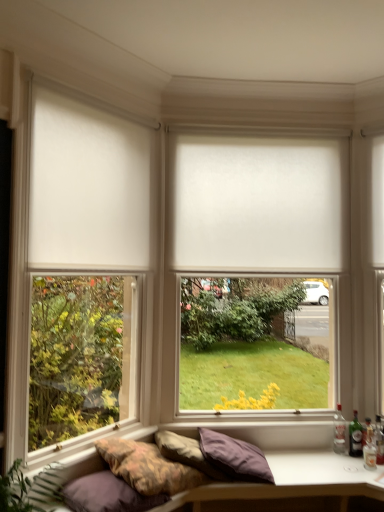
Locate an element on the screen. The height and width of the screenshot is (512, 384). purple fabric pillow at lower center, the second pillow in the right-to-left sequence is located at coordinates (186, 453).

The width and height of the screenshot is (384, 512). What do you see at coordinates (186, 453) in the screenshot?
I see `purple fabric pillow at lower center, the second pillow in the right-to-left sequence` at bounding box center [186, 453].

Image resolution: width=384 pixels, height=512 pixels. Describe the element at coordinates (291, 482) in the screenshot. I see `textured fabric studio couch at lower center` at that location.

Describe the element at coordinates (355, 436) in the screenshot. I see `green glass bottle at lower right, which appears as the 3th bottle when viewed from the right` at that location.

What is the approximate height of white matte window at center?

white matte window at center is 7.32 feet in height.

What do you see at coordinates (88, 187) in the screenshot? I see `white matte curtain at left` at bounding box center [88, 187].

Where is `white matte window frame at upper left`? white matte window frame at upper left is located at coordinates (77, 272).

At what (x,y) coordinates should I click in order to perform the action: click on white matte window blind at center. Please return your answer as a coordinate pair (x, y). Image resolution: width=384 pixels, height=512 pixels. Looking at the image, I should click on (258, 204).

Can we say translucent glass bottle at right, which appears as the second bottle when viewed from the right, lies outside textured fabric studio couch at lower center?

Absolutely, translucent glass bottle at right, which appears as the second bottle when viewed from the right, is external to textured fabric studio couch at lower center.

Consider the image. Does translucent glass bottle at right, which appears as the second bottle when viewed from the right, have a lesser height compared to textured fabric studio couch at lower center?

Yes.

Who is smaller, translucent glass bottle at right, which appears as the second bottle when viewed from the right, or textured fabric studio couch at lower center?

translucent glass bottle at right, which appears as the second bottle when viewed from the right, is smaller.

Is textured fabric studio couch at lower center at the back of translucent glass bottle at right, which appears as the third bottle when viewed from the left?

translucent glass bottle at right, which appears as the third bottle when viewed from the left, does not have its back to textured fabric studio couch at lower center.

Is point (367, 426) closer to camera compared to point (381, 430)?

No, it is not.

Which object is more forward, translucent glass bottle at right, which appears as the second bottle when viewed from the right, or translucent glass bottle at right, the 4th bottle from the left?

translucent glass bottle at right, the 4th bottle from the left, is in front.

Considering the sizes of objects translucent glass bottle at right, which appears as the second bottle when viewed from the right, and translucent glass bottle at right, the 4th bottle from the left, in the image provided, who is wider, translucent glass bottle at right, which appears as the second bottle when viewed from the right, or translucent glass bottle at right, the 4th bottle from the left,?

With larger width is translucent glass bottle at right, which appears as the second bottle when viewed from the right.

Which object is wider, white matte window frame at upper left or translucent glass bottle at right, the first bottle viewed from the right?

white matte window frame at upper left is wider.

Is white matte window frame at upper left to the left or to the right of translucent glass bottle at right, the first bottle viewed from the right, in the image?

From the image, it's evident that white matte window frame at upper left is to the left of translucent glass bottle at right, the first bottle viewed from the right.

In the scene shown: Is white matte window frame at upper left facing towards translucent glass bottle at right, the 4th bottle from the left?

No, white matte window frame at upper left is not turned towards translucent glass bottle at right, the 4th bottle from the left.

Considering the sizes of white matte window frame at upper left and translucent glass bottle at right, the first bottle viewed from the right, in the image, is white matte window frame at upper left bigger or smaller than translucent glass bottle at right, the first bottle viewed from the right,?

Considering their sizes, white matte window frame at upper left takes up more space than translucent glass bottle at right, the first bottle viewed from the right.

From a real-world perspective, which object stands above the other?

translucent glass bottle at right, the first bottle viewed from the right, is physically above.

Does point (131, 497) appear closer or farther from the camera than point (381, 431)?

Point (131, 497) appears to be closer to the viewer than point (381, 431).

How far apart are purple cotton pillow at lower left, the 1th pillow in the left-to-right sequence, and translucent glass bottle at right, the first bottle viewed from the right?

purple cotton pillow at lower left, the 1th pillow in the left-to-right sequence, is 5.47 feet away from translucent glass bottle at right, the first bottle viewed from the right.

Which object is thinner, purple cotton pillow at lower left, which is the 3th pillow from right to left, or translucent glass bottle at right, the 4th bottle from the left?

With smaller width is translucent glass bottle at right, the 4th bottle from the left.

Is point (350, 434) more distant than point (92, 488)?

Yes, it is behind point (92, 488).

Is green glass bottle at lower right, which appears as the 2th bottle when viewed from the left, in front of or behind purple cotton pillow at lower left, which is the 3th pillow from right to left, in the image?

green glass bottle at lower right, which appears as the 2th bottle when viewed from the left, is positioned farther from the viewer than purple cotton pillow at lower left, which is the 3th pillow from right to left.

In terms of width, does green glass bottle at lower right, which appears as the 2th bottle when viewed from the left, look wider or thinner when compared to purple cotton pillow at lower left, which is the 3th pillow from right to left?

Considering their sizes, green glass bottle at lower right, which appears as the 2th bottle when viewed from the left, looks slimmer than purple cotton pillow at lower left, which is the 3th pillow from right to left.

Based on their sizes in the image, would you say green glass bottle at lower right, which appears as the 3th bottle when viewed from the right, is bigger or smaller than purple cotton pillow at lower left, which is the 3th pillow from right to left?

Considering their sizes, green glass bottle at lower right, which appears as the 3th bottle when viewed from the right, takes up less space than purple cotton pillow at lower left, which is the 3th pillow from right to left.

Based on the photo, between translucent glass bottle at right, which appears as the third bottle when viewed from the left, and white matte window at center, which one has larger size?

white matte window at center is bigger.

Considering the relative positions of translucent glass bottle at right, which appears as the second bottle when viewed from the right, and white matte window at center in the image provided, is translucent glass bottle at right, which appears as the second bottle when viewed from the right, to the left of white matte window at center from the viewer's perspective?

No.

Can you confirm if translucent glass bottle at right, which appears as the second bottle when viewed from the right, is shorter than white matte window at center?

Yes.

Could you tell me if translucent glass bottle at right, which appears as the second bottle when viewed from the right, is turned towards white matte window at center?

No, translucent glass bottle at right, which appears as the second bottle when viewed from the right, is not facing towards white matte window at center.

From the picture: From the image's perspective, is white matte window at center on white matte window blind at center?

No, from the image's perspective, white matte window at center is not on top of white matte window blind at center.

Can white matte window blind at center be found inside white matte window at center?

Yes.

Does white matte window at center have a larger size compared to white matte window blind at center?

Yes.

Based on the photo, is white matte window at center facing away from white matte window blind at center?

Yes, white matte window at center is positioned with its back facing white matte window blind at center.

From a real-world perspective, which bottle is the 1st one above the textured fabric studio couch at lower center? Please provide its 2D coordinates.

[(367, 432)]

You are a GUI agent. You are given a task and a screenshot of the screen. Output one action in this format:
    pyautogui.click(x=<x>, y=<y>)
    Task: Click on the bottle below the translucent glass bottle at right, the 4th bottle from the left (from a real-world perspective)
    The image size is (384, 512).
    Given the screenshot: What is the action you would take?
    pyautogui.click(x=367, y=432)

When comparing their distances from clear glass bottle at lower right, which is counted as the fourth bottle, starting from the right, does white matte window blind at center or white matte curtain at left seem closer?

Among the two, white matte window blind at center is located nearer to clear glass bottle at lower right, which is counted as the fourth bottle, starting from the right.

Looking at the image, which one is located closer to white matte window at center, white matte curtain at left or purple fabric pillow at lower center, positioned as the first pillow in right-to-left order?

white matte curtain at left is positioned closer to the anchor white matte window at center.

Based on their spatial positions, is white matte window blind at center or purple fabric pillow at lower center, positioned as the first pillow in right-to-left order, further from purple cotton pillow at lower left, the 1th pillow in the left-to-right sequence?

Based on the image, white matte window blind at center appears to be further to purple cotton pillow at lower left, the 1th pillow in the left-to-right sequence.

Estimate the real-world distances between objects in this image. Which object is further from clear glass bottle at lower right, which is counted as the fourth bottle, starting from the right, green glass bottle at lower right, which appears as the 3th bottle when viewed from the right, or white matte window frame at upper left?

Answer: white matte window frame at upper left is positioned further to the anchor clear glass bottle at lower right, which is counted as the fourth bottle, starting from the right.

Looking at the image, which one is located further to purple fabric pillow at lower center, positioned as the first pillow in right-to-left order, green glass bottle at lower right, which appears as the 3th bottle when viewed from the right, or clear glass bottle at lower right, which is counted as the fourth bottle, starting from the right?

green glass bottle at lower right, which appears as the 3th bottle when viewed from the right, is positioned further to the anchor purple fabric pillow at lower center, positioned as the first pillow in right-to-left order.

Considering their positions, is white matte window frame at upper left positioned further to green glass bottle at lower right, which appears as the 3th bottle when viewed from the right, than purple fabric pillow at lower center, acting as the 3th pillow starting from the left?

The object further to green glass bottle at lower right, which appears as the 3th bottle when viewed from the right, is white matte window frame at upper left.

In the scene shown: Based on their spatial positions, is purple fabric pillow at lower center, the second pillow in the right-to-left sequence, or purple fabric pillow at lower center, acting as the 3th pillow starting from the left, further from translucent glass bottle at right, the 4th bottle from the left?

purple fabric pillow at lower center, the second pillow in the right-to-left sequence, is positioned further to the anchor translucent glass bottle at right, the 4th bottle from the left.

Considering their positions, is clear glass bottle at lower right, which is counted as the fourth bottle, starting from the right, positioned further to green glass bottle at lower right, which appears as the 2th bottle when viewed from the left, than purple cotton pillow at lower left, the 1th pillow in the left-to-right sequence?

purple cotton pillow at lower left, the 1th pillow in the left-to-right sequence.

You are a GUI agent. You are given a task and a screenshot of the screen. Output one action in this format:
    pyautogui.click(x=<x>, y=<y>)
    Task: Click on the pillow located between purple fabric pillow at lower center, the second pillow in the right-to-left sequence, and green glass bottle at lower right, which appears as the 3th bottle when viewed from the right, in the left-right direction
    The height and width of the screenshot is (512, 384).
    Given the screenshot: What is the action you would take?
    pyautogui.click(x=235, y=457)

The height and width of the screenshot is (512, 384). I want to click on pillow between white matte window at center and translucent glass bottle at right, which appears as the third bottle when viewed from the left, from top to bottom, so click(186, 453).

Where is `pillow between white matte window at center and purple cotton pillow at lower left, the 1th pillow in the left-to-right sequence, in the up-down direction`? pillow between white matte window at center and purple cotton pillow at lower left, the 1th pillow in the left-to-right sequence, in the up-down direction is located at coordinates (186, 453).

The width and height of the screenshot is (384, 512). What are the coordinates of `window frame between white matte curtain at left and textured fabric studio couch at lower center from top to bottom` in the screenshot? It's located at point(77,272).